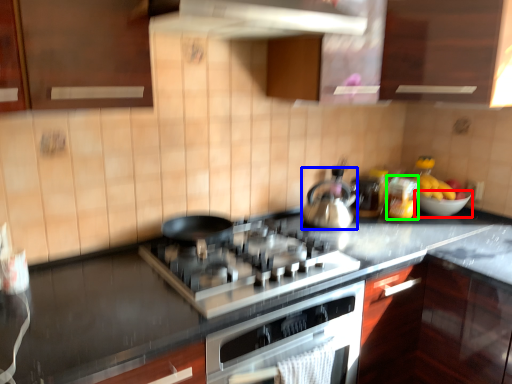
Question: Which is nearer to the bowl (highlighted by a red box)? kitchen appliance (highlighted by a blue box) or appliance (highlighted by a green box).

Choices:
 (A) kitchen appliance
 (B) appliance

Answer: (B)